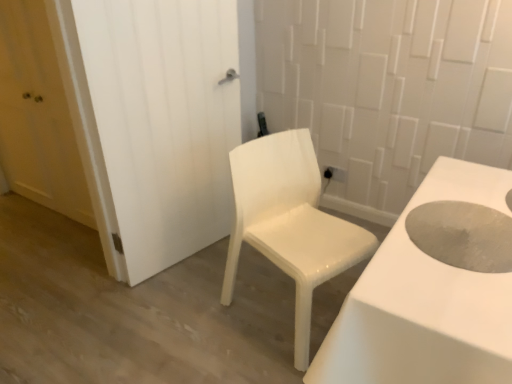
Question: In the image, is white glossy chair at center on the left side or the right side of matte white door at left, which ranks as the 1th door in left-to-right order?

Choices:
 (A) right
 (B) left

Answer: (A)

Question: Considering the positions of point (231, 165) and point (15, 87), is point (231, 165) closer or farther from the camera than point (15, 87)?

Choices:
 (A) farther
 (B) closer

Answer: (B)

Question: Estimate the real-world distances between objects in this image. Which object is farther from the white matte door at center, which is the 1th door from right to left?

Choices:
 (A) white glossy chair at center
 (B) matte white door at left, which ranks as the 2th door in right-to-left order
 (C) gray matte hole at center right

Answer: (C)

Question: Based on their relative distances, which object is nearer to the matte white door at left, which ranks as the 1th door in left-to-right order?

Choices:
 (A) white matte door at center, marked as the second door in a left-to-right arrangement
 (B) white glossy chair at center
 (C) gray matte hole at center right

Answer: (A)